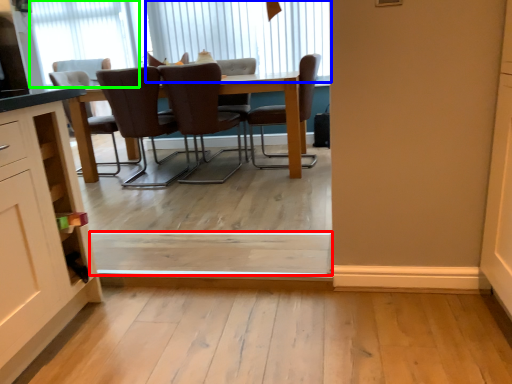
Question: Based on their relative distances, which object is farther from plank (highlighted by a red box)? Choose from window (highlighted by a blue box) and window (highlighted by a green box).

Choices:
 (A) window
 (B) window

Answer: (B)